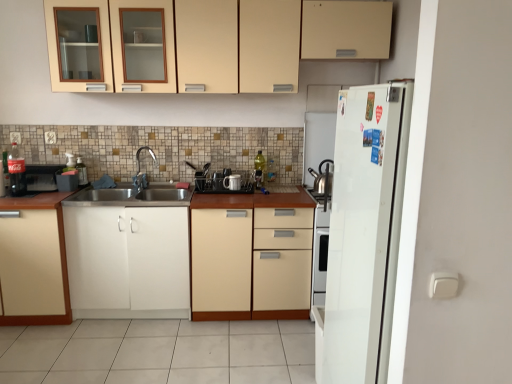
Locate an element on the screen. free location in front of translucent glass bottle at center, the 1th bottle positioned from the right is located at coordinates (256, 192).